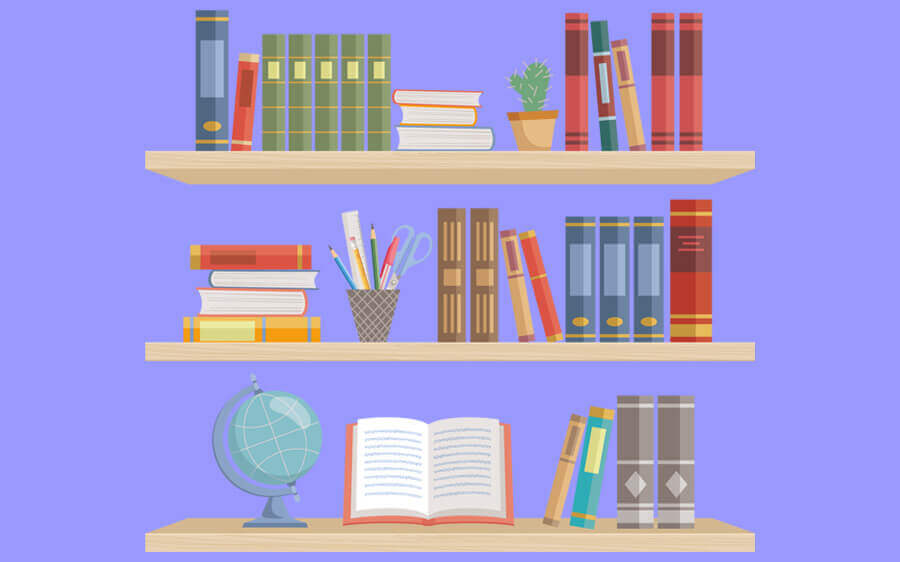
The width and height of the screenshot is (900, 562). Find the location of `books stacked horizontally`. books stacked horizontally is located at coordinates (447, 146), (447, 119), (452, 95), (279, 250), (281, 273), (279, 305), (276, 325).